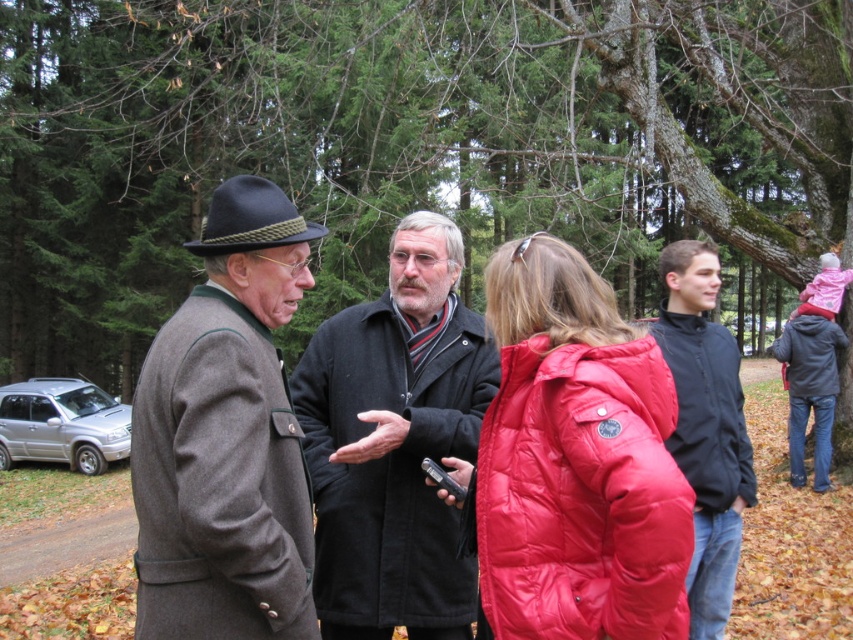
Question: Is matte red puffer jacket at center below dark blue jacket at center?

Choices:
 (A) yes
 (B) no

Answer: (A)

Question: Estimate the real-world distances between objects in this image. Which object is closer to the dark gray jacket at right?

Choices:
 (A) brown woolen coat at left
 (B) dark blue felt plug hat at upper left

Answer: (B)

Question: Based on their relative distances, which object is farther from the dark blue felt plug hat at upper left?

Choices:
 (A) black wool coat at center
 (B) dark gray jacket at right
 (C) matte red puffer jacket at center

Answer: (B)

Question: Which is farther from the matte red puffer jacket at center?

Choices:
 (A) dark blue jacket at center
 (B) dark gray quilted jacket at right

Answer: (B)

Question: Is smooth bark tree at center bigger than black wool coat at center?

Choices:
 (A) yes
 (B) no

Answer: (A)

Question: Can you confirm if matte red puffer jacket at center is bigger than dark blue jacket at center?

Choices:
 (A) no
 (B) yes

Answer: (B)